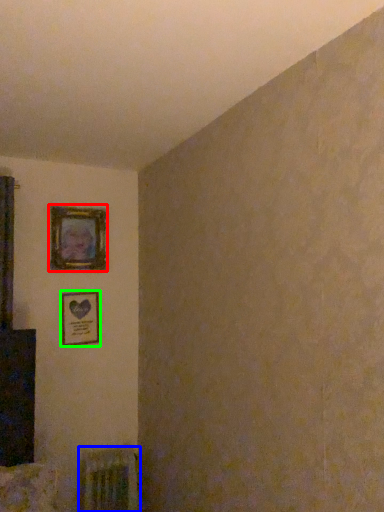
Question: Which is farther away from picture frame (highlighted by a red box)? radiator (highlighted by a blue box) or picture frame (highlighted by a green box)?

Choices:
 (A) radiator
 (B) picture frame

Answer: (A)